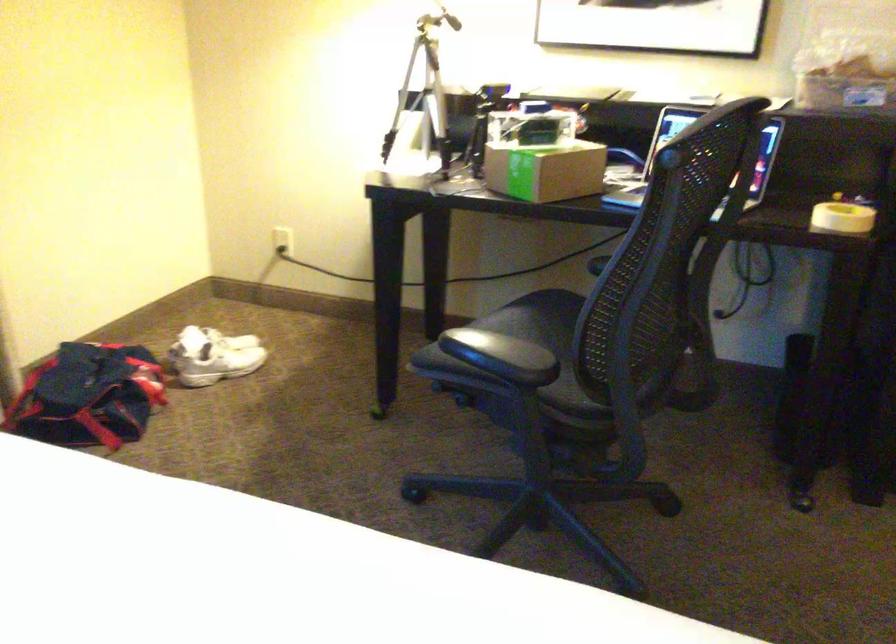
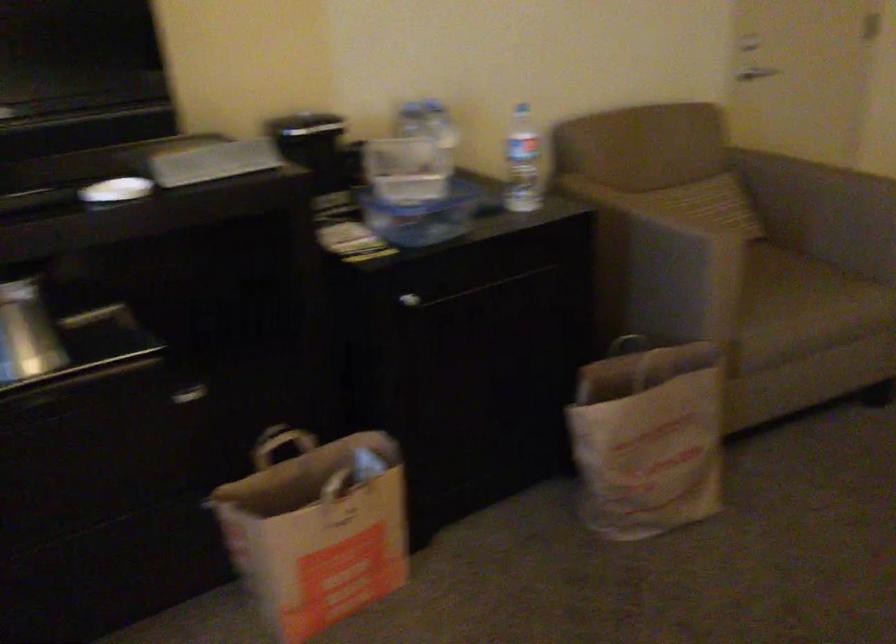
Question: Based on the continuous images, in which direction is the camera rotating? Reply with the corresponding letter.

Choices:
 (A) Left
 (B) Right
 (C) Up
 (D) Down

Answer: (B)